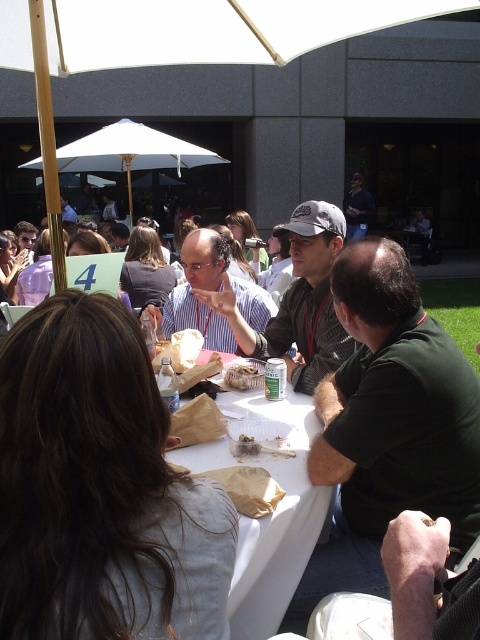
Is dark green shirt at center taller than matte black shirt at center?

Correct, dark green shirt at center is much taller as matte black shirt at center.

Does dark green shirt at center appear on the left side of matte black shirt at center?

No, dark green shirt at center is not to the left of matte black shirt at center.

Is point (361, 384) positioned before point (307, 365)?

Yes, it is in front of point (307, 365).

You are a GUI agent. You are given a task and a screenshot of the screen. Output one action in this format:
    pyautogui.click(x=<x>, y=<y>)
    Task: Click on the dark green shirt at center
    
    Given the screenshot: What is the action you would take?
    pyautogui.click(x=388, y=422)

Between dark green shirt at center and white paper table at center, which one is positioned higher?

dark green shirt at center

Between point (335, 381) and point (251, 401), which one is positioned in front?

Point (335, 381)

This screenshot has height=640, width=480. Identify the location of dark green shirt at center. (388, 422).

Does matte white shirt at center appear under brown paper bag at table?

No.

Between matte white shirt at center and brown paper bag at table, which one is positioned lower?

brown paper bag at table

Which is in front, point (195, 310) or point (278, 454)?

Point (278, 454) is in front.

Where is `matte white shirt at center`? Image resolution: width=480 pixels, height=640 pixels. matte white shirt at center is located at coordinates (211, 291).